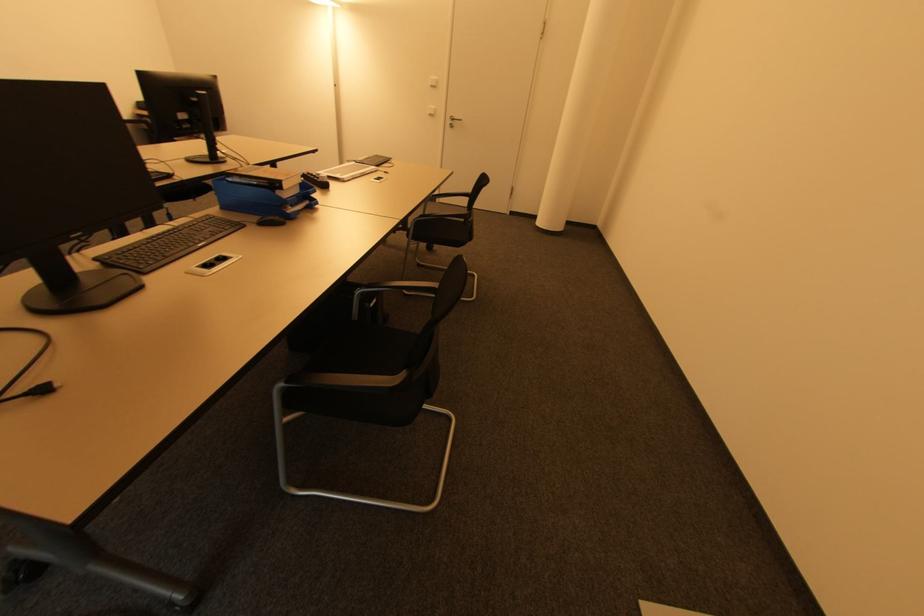
Which object does [432,81] point to?

It corresponds to the white desk outlet in the image.